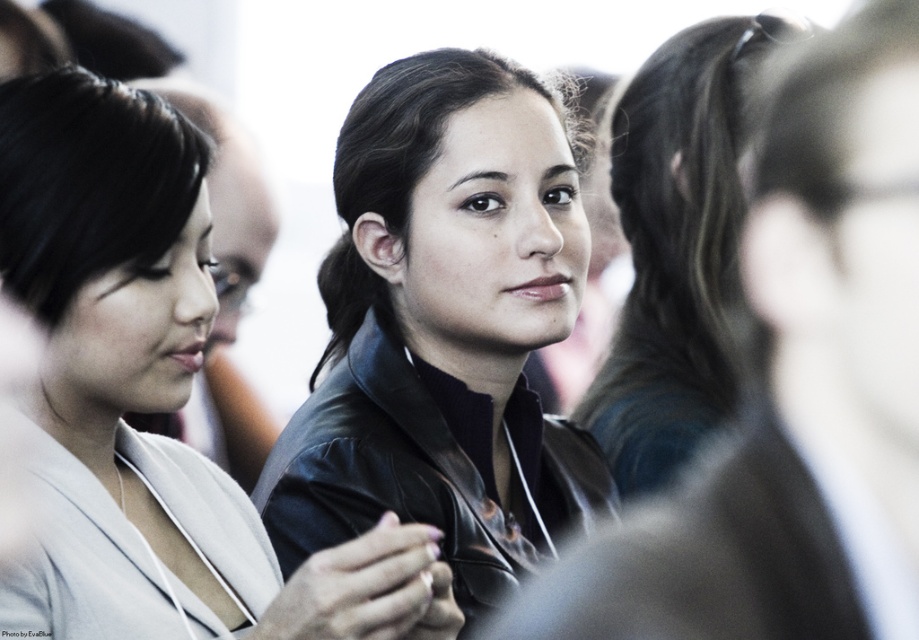
Is point (536, 163) positioned behind point (46, 118)?

Yes.

Is point (452, 364) farther from viewer compared to point (201, 604)?

Yes.

Locate an element on the screen. The image size is (919, 640). matte black jacket at center is located at coordinates (443, 330).

Looking at this image, between black leather jacket at center and dark brown hair at center, which one appears on the left side from the viewer's perspective?

black leather jacket at center

Which is behind, point (37, 259) or point (693, 433)?

The point (693, 433) is more distant.

Is point (93, 76) farther from viewer compared to point (645, 365)?

That is False.

Where is `black leather jacket at center`? The width and height of the screenshot is (919, 640). black leather jacket at center is located at coordinates (165, 352).

Looking at this image, between matte black jacket at center and dark brown hair at center, which one is positioned lower?

Positioned lower is matte black jacket at center.

Does matte black jacket at center come in front of dark brown hair at center?

Yes, it is.

At what (x,y) coordinates should I click in order to perform the action: click on matte black jacket at center. Please return your answer as a coordinate pair (x, y). Looking at the image, I should click on (443, 330).

Image resolution: width=919 pixels, height=640 pixels. Identify the location of matte black jacket at center. (443, 330).